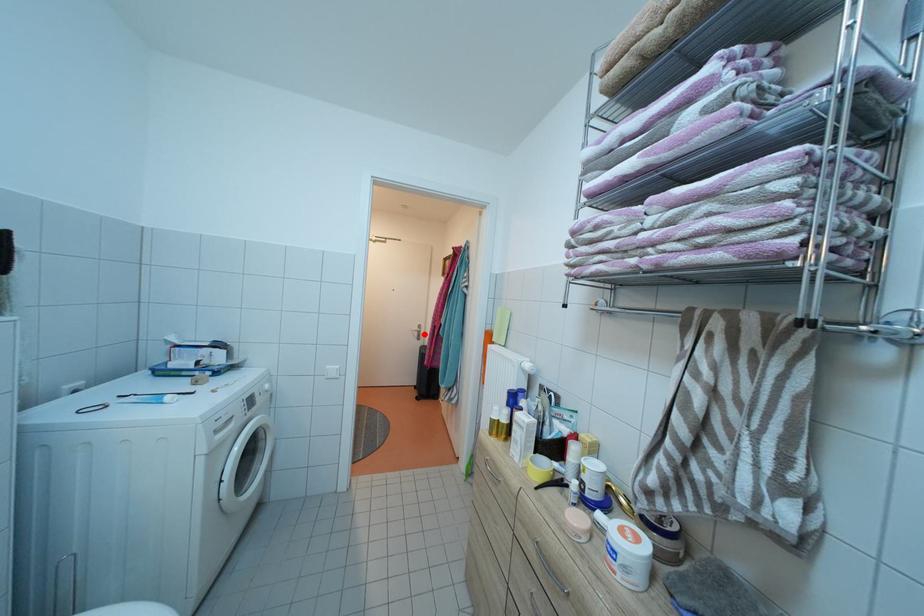
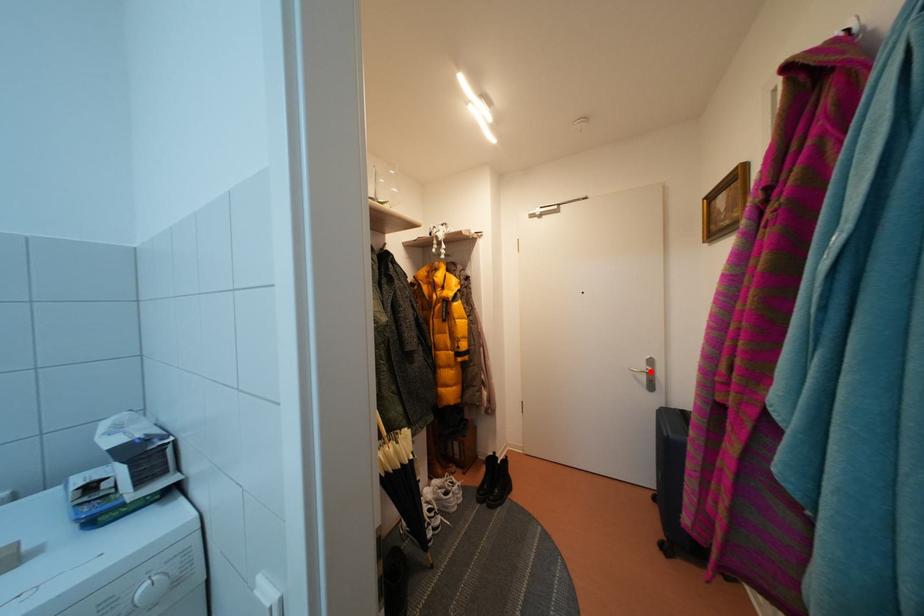
I am providing you with two images of the same scene from different viewpoints. A red point is marked on the first image and another point is marked on the second image. Does the point marked in image1 correspond to the same location as the one in image2?

Yes